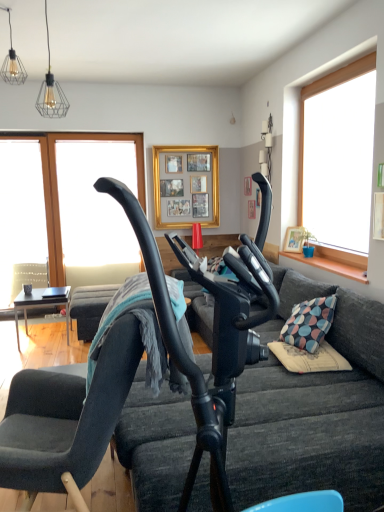
Question: Does dark gray fabric couch at center have a greater height compared to transparent glass window at left, marked as the second window screen in a right-to-left arrangement?

Choices:
 (A) no
 (B) yes

Answer: (A)

Question: Is dark gray fabric couch at center to the left of transparent glass window at left, marked as the second window screen in a right-to-left arrangement, from the viewer's perspective?

Choices:
 (A) no
 (B) yes

Answer: (A)

Question: Can transparent glass window at left, marked as the second window screen in a right-to-left arrangement, be found inside dark gray fabric couch at center?

Choices:
 (A) yes
 (B) no

Answer: (B)

Question: Does dark gray fabric couch at center have a greater width compared to transparent glass window at left, marked as the second window screen in a right-to-left arrangement?

Choices:
 (A) yes
 (B) no

Answer: (A)

Question: Is dark gray fabric couch at center next to transparent glass window at left, which appears as the 1th window screen when viewed from the left, and touching it?

Choices:
 (A) yes
 (B) no

Answer: (B)

Question: Can you confirm if dark gray fabric couch at center is positioned to the right of transparent glass window at left, which appears as the 1th window screen when viewed from the left?

Choices:
 (A) no
 (B) yes

Answer: (B)

Question: Can you confirm if dark gray fabric couch at center is thinner than gold/gilded picture frame at upper center?

Choices:
 (A) no
 (B) yes

Answer: (A)

Question: Is dark gray fabric couch at center far from gold/gilded picture frame at upper center?

Choices:
 (A) no
 (B) yes

Answer: (B)

Question: Could gold/gilded picture frame at upper center be considered to be inside dark gray fabric couch at center?

Choices:
 (A) no
 (B) yes

Answer: (A)

Question: Is dark gray fabric couch at center at the left side of gold/gilded picture frame at upper center?

Choices:
 (A) yes
 (B) no

Answer: (B)

Question: Considering the relative sizes of dark gray fabric couch at center and gold/gilded picture frame at upper center in the image provided, is dark gray fabric couch at center bigger than gold/gilded picture frame at upper center?

Choices:
 (A) yes
 (B) no

Answer: (A)

Question: Can you confirm if dark gray fabric couch at center is positioned to the right of gold/gilded picture frame at upper center?

Choices:
 (A) yes
 (B) no

Answer: (A)

Question: Is velvet dark gray chair at center thinner than transparent glass window at upper left, which ranks as the second window screen in left-to-right order?

Choices:
 (A) no
 (B) yes

Answer: (A)